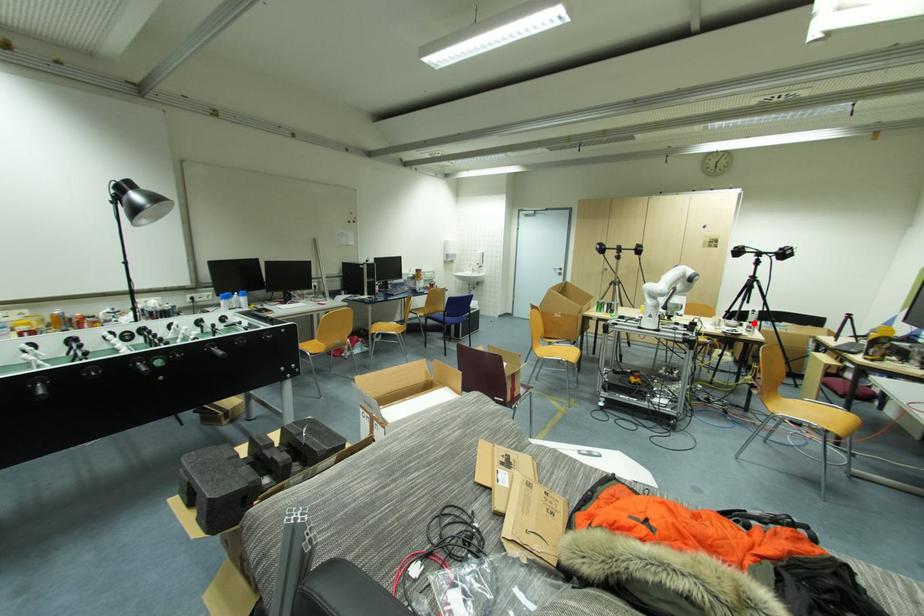
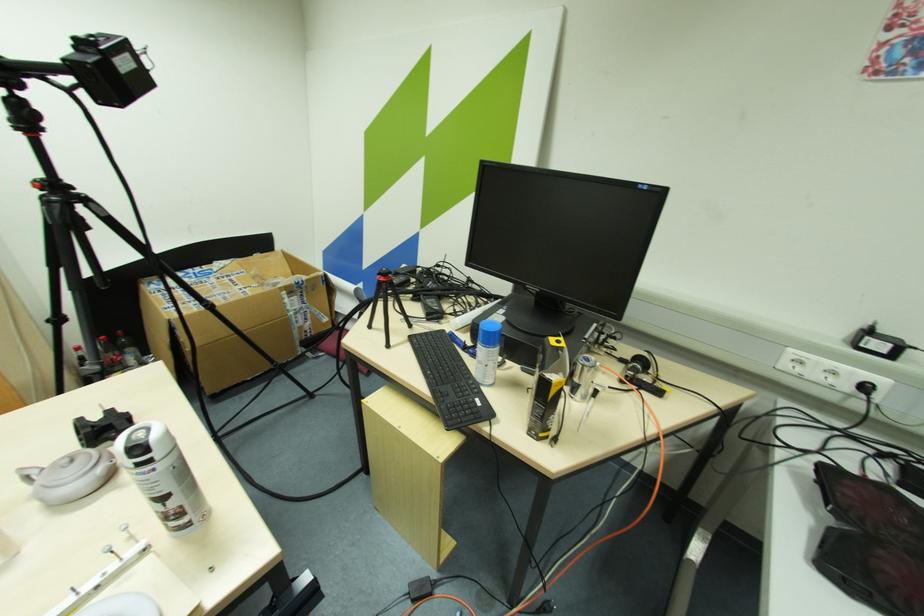
Question: I am providing you with two images of the same scene from different viewpoints. A red point is marked on the first image. Can you still see the location of the red point in image 2?

Choices:
 (A) Yes
 (B) No

Answer: (A)